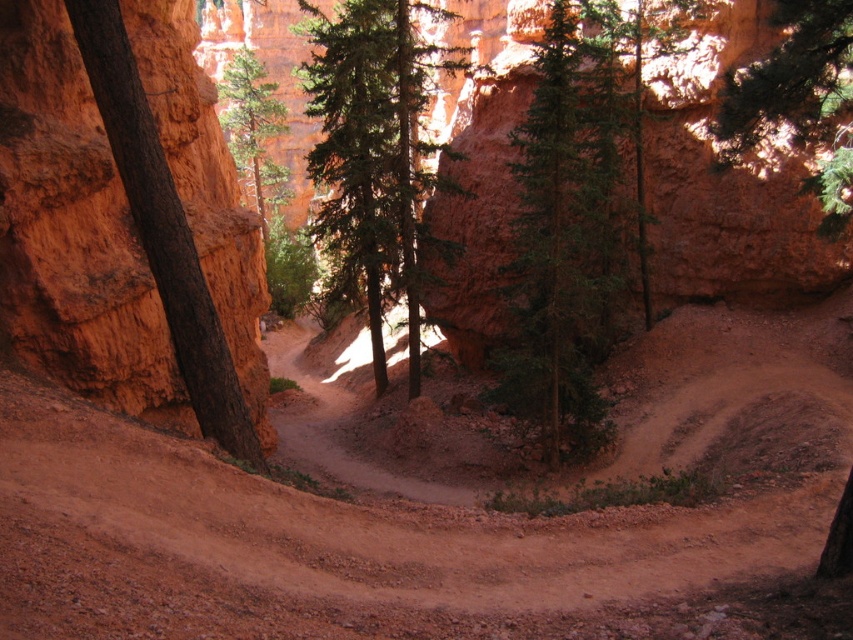
You are a hiker standing on the winding dirt path in the canyon. You see a green textured tree at center and a brown rough bark tree at left. Which tree is closer to you?

The green textured tree at center is positioned over the brown rough bark tree at left, meaning it is closer to you.

You are standing at the starting point of the hiking trail in this canyon. You notice two points marked on the map as point (212,365) and point (755,132). Which of these points is closer to your current position?

Point (212,365) is closer to the viewer than point (755,132), so the point closer to your current position is point (212,365).